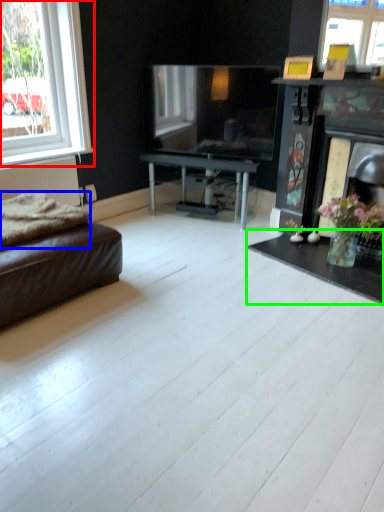
Question: Which is nearer to the window (highlighted by a red box)? blanket (highlighted by a blue box) or coffee table (highlighted by a green box).

Choices:
 (A) blanket
 (B) coffee table

Answer: (A)